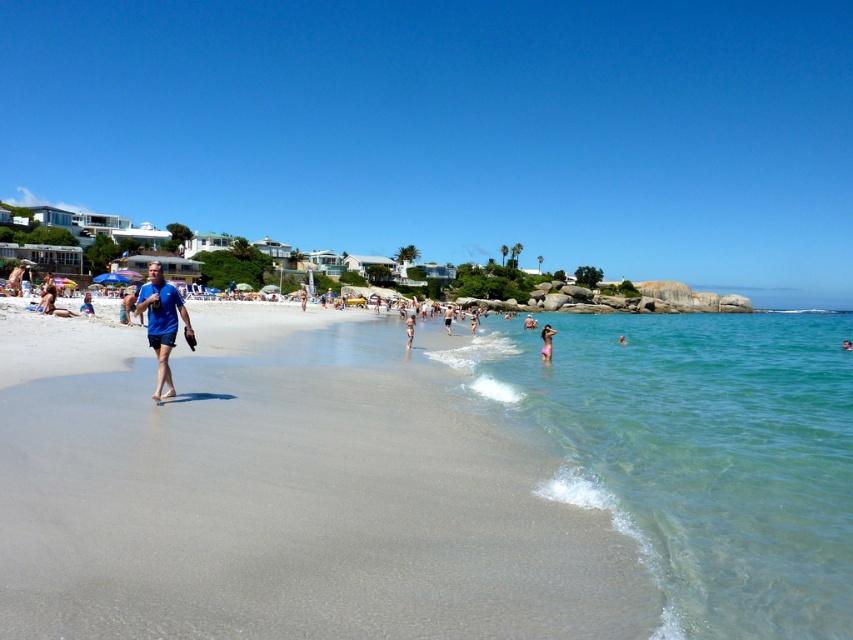
You are a photographer trying to capture a shot of the smooth skin person at center and the pink fabric at center. Since you want to ensure both are in focus, you need to know which object is taller. Can you tell me which one is taller?

The pink fabric at center has a greater height compared to the smooth skin person at center, so the pink fabric at center is taller.

You are a photographer trying to capture the pink fabric at center in the beach scene. Based on its coordinates, where should you aim your camera to ensure it is centered in your shot?

To center the pink fabric at center in your shot, aim your camera at the coordinates point (409, 330), which is the exact position of the pink fabric at center.

You are a photographer trying to capture the blue fabric shirt at left in your shot. Based on the scene description, where should you position yourself relative to the point marked at coordinates (126, 305) to ensure the shirt is visible in the frame?

The point at (126, 305) marks the location of the blue fabric shirt at left, so positioning yourself directly at that coordinate would center the shirt in your frame. Alternatively, adjusting slightly to the right of the point might keep the shirt within the left portion of the shot while including more of the surrounding beach scene.